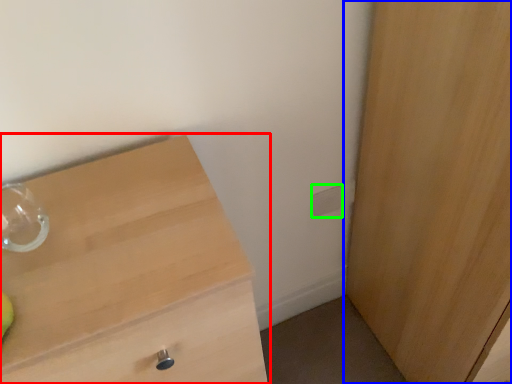
Question: Based on their relative distances, which object is nearer to chest of drawers (highlighted by a red box)? Choose from cupboard (highlighted by a blue box) and electric outlet (highlighted by a green box).

Choices:
 (A) cupboard
 (B) electric outlet

Answer: (A)